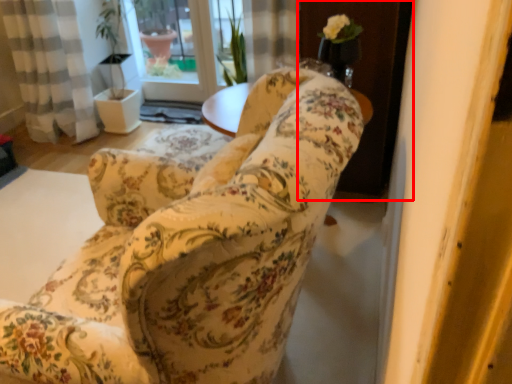
Question: From the image's perspective, what is the correct spatial relationship of screen door (annotated by the red box) in relation to chair?

Choices:
 (A) above
 (B) below

Answer: (A)